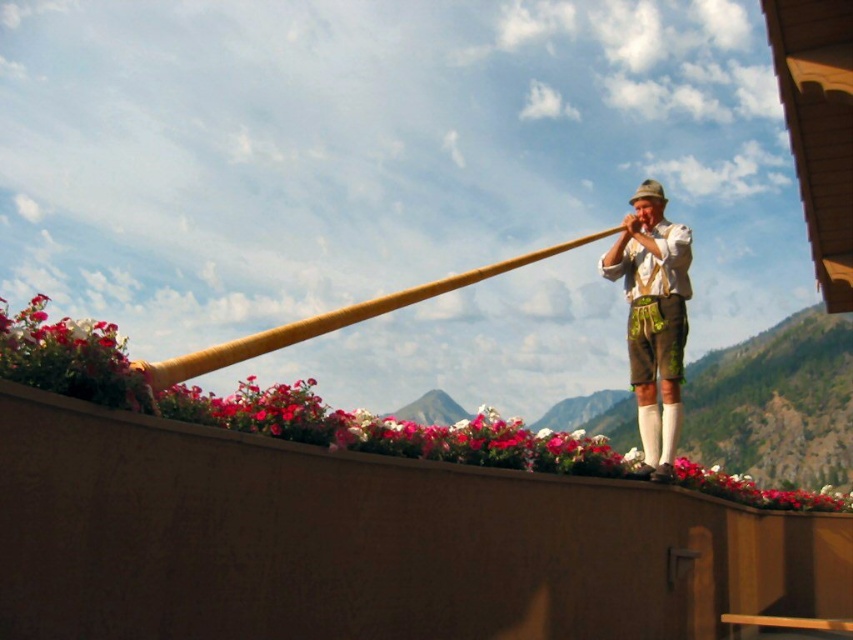
Question: Which of the following is the closest to the observer?

Choices:
 (A) brown leather shorts at center
 (B) wooden horn at upper center

Answer: (B)

Question: Can you confirm if brown leather shorts at center is smaller than wooden horn at upper center?

Choices:
 (A) no
 (B) yes

Answer: (B)

Question: Among these objects, which one is farthest from the camera?

Choices:
 (A) brown leather shorts at center
 (B) wooden horn at upper center

Answer: (A)

Question: Can you confirm if brown leather shorts at center is positioned below wooden horn at upper center?

Choices:
 (A) no
 (B) yes

Answer: (B)

Question: Which of the following is the farthest from the observer?

Choices:
 (A) (245, 356)
 (B) (659, 300)

Answer: (B)

Question: Observing the image, what is the correct spatial positioning of brown leather shorts at center in reference to wooden horn at upper center?

Choices:
 (A) right
 (B) left

Answer: (A)